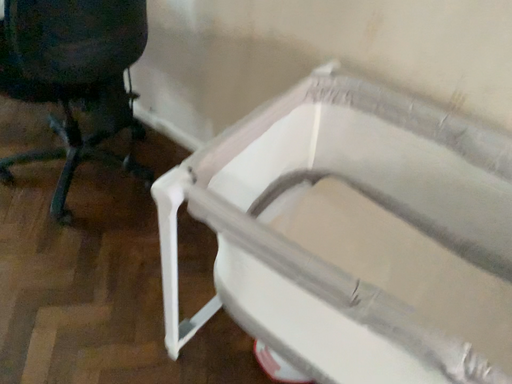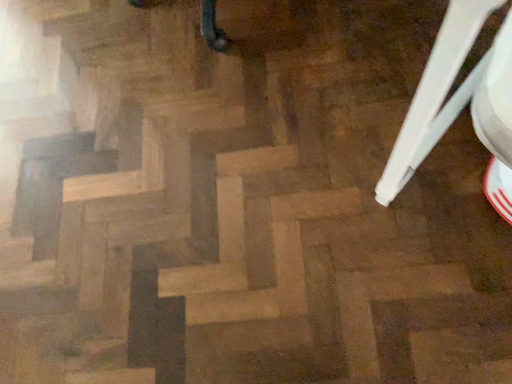
Question: Which way did the camera rotate in the video?

Choices:
 (A) rotated left
 (B) rotated right

Answer: (A)